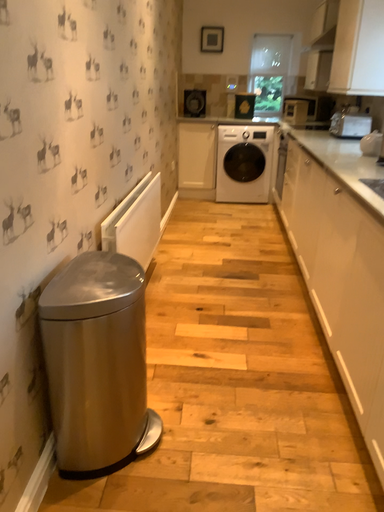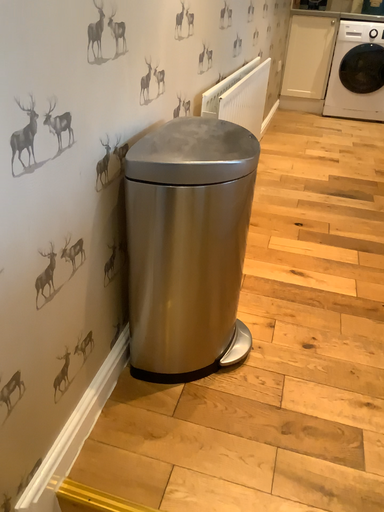
Question: How did the camera likely rotate when shooting the video?

Choices:
 (A) rotated right
 (B) rotated left

Answer: (B)